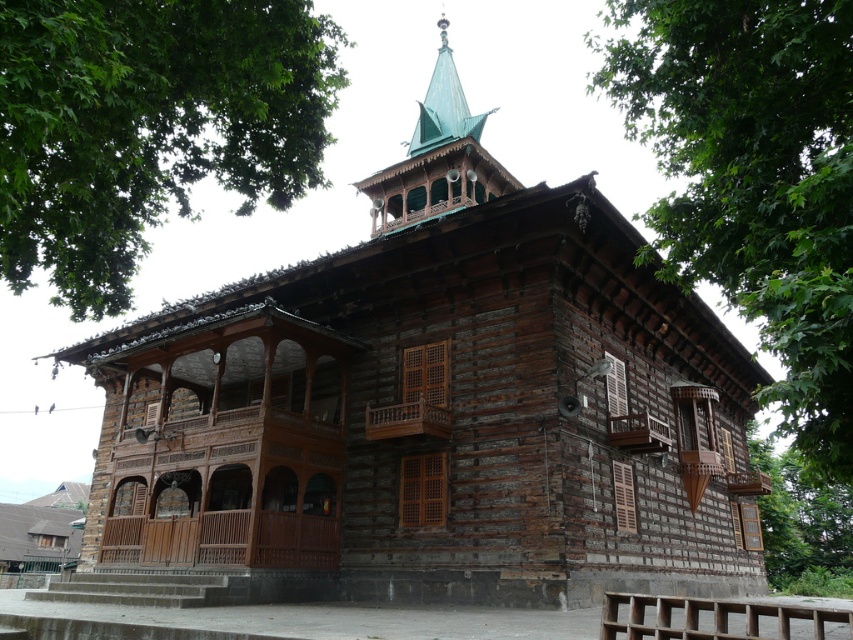
Question: Which point is farther to the camera?

Choices:
 (A) green leafy tree at upper left
 (B) green leafy tree at upper right
 (C) green copper spire at upper center

Answer: (C)

Question: Can you confirm if green leafy tree at upper left is wider than green copper spire at upper center?

Choices:
 (A) yes
 (B) no

Answer: (A)

Question: Does green leafy tree at upper left have a smaller size compared to green leafy tree at upper right?

Choices:
 (A) yes
 (B) no

Answer: (A)

Question: Which object is positioned farthest from the green leafy tree at upper left?

Choices:
 (A) green leafy tree at upper right
 (B) green copper spire at upper center

Answer: (B)

Question: Does green leafy tree at upper left appear under green leafy tree at upper right?

Choices:
 (A) no
 (B) yes

Answer: (B)

Question: Among these objects, which one is farthest from the camera?

Choices:
 (A) green leafy tree at upper right
 (B) green copper spire at upper center

Answer: (B)